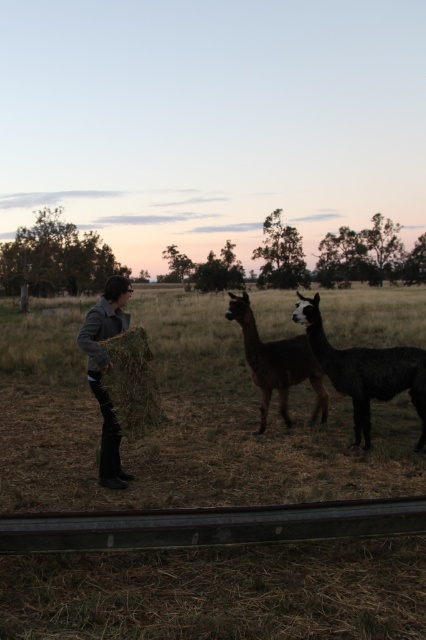
Question: Can you confirm if dark brown woolly alpaca at right is thinner than brown woolen alpaca at center?

Choices:
 (A) yes
 (B) no

Answer: (B)

Question: Which of the following is the closest to the observer?

Choices:
 (A) (345, 356)
 (B) (103, 326)
 (C) (317, 403)

Answer: (B)

Question: Which object appears closest to the camera in this image?

Choices:
 (A) brown woolen alpaca at center
 (B) dark brown woolly alpaca at right

Answer: (B)

Question: Is dark brown woolly alpaca at right to the left of gray woolen jacket at left from the viewer's perspective?

Choices:
 (A) no
 (B) yes

Answer: (A)

Question: Does brown woolen alpaca at center have a greater width compared to gray woolen jacket at left?

Choices:
 (A) yes
 (B) no

Answer: (A)

Question: Which point is farther from the camera taking this photo?

Choices:
 (A) (86, 314)
 (B) (268, 356)
 (C) (359, 440)

Answer: (A)